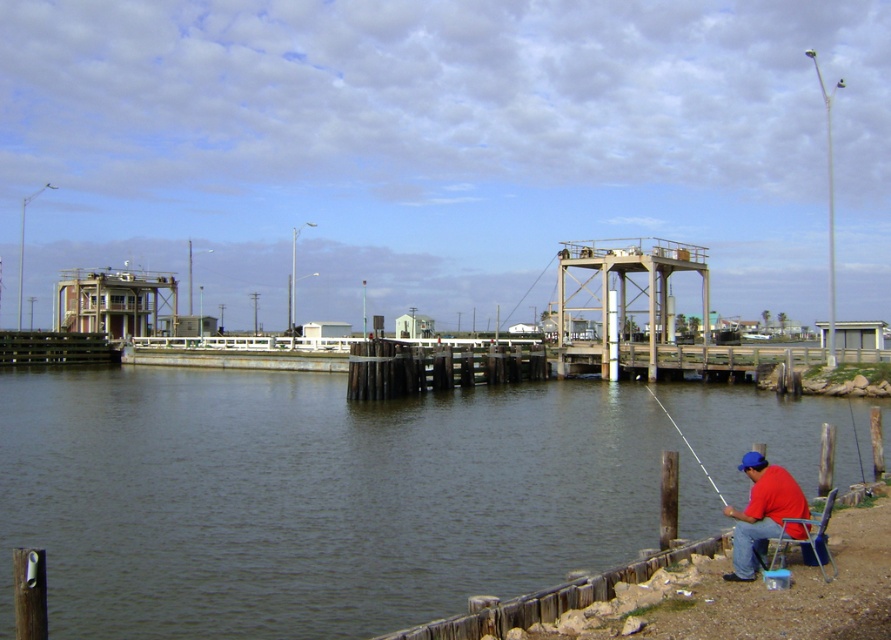
Who is higher up, blue plastic chair at lower right or white plastic fishing pole at lower right?

blue plastic chair at lower right is above.

The width and height of the screenshot is (891, 640). What are the coordinates of `blue plastic chair at lower right` in the screenshot? It's located at (806, 540).

Where is `blue plastic chair at lower right`? This screenshot has height=640, width=891. blue plastic chair at lower right is located at coordinates (806, 540).

Who is shorter, dark gray water at lower left or blue plastic chair at lower right?

blue plastic chair at lower right is shorter.

Between point (405, 461) and point (786, 520), which one is positioned in front?

Point (786, 520)

What do you see at coordinates (317, 497) in the screenshot? I see `dark gray water at lower left` at bounding box center [317, 497].

Where is `dark gray water at lower left`? This screenshot has height=640, width=891. dark gray water at lower left is located at coordinates (317, 497).

Is point (527, 390) closer to viewer compared to point (806, 509)?

That is False.

Describe the element at coordinates (317, 497) in the screenshot. I see `dark gray water at lower left` at that location.

Image resolution: width=891 pixels, height=640 pixels. In order to click on dark gray water at lower left in this screenshot , I will do `click(317, 497)`.